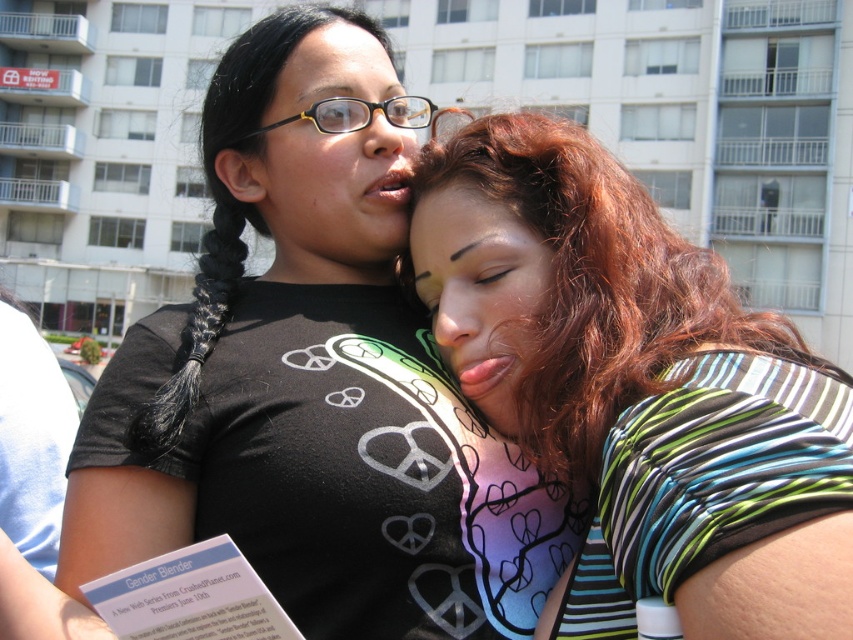
Question: Which point is farther to the camera?

Choices:
 (A) matte black hair at upper center
 (B) striped fabric shirt at center

Answer: (A)

Question: Is striped fabric shirt at center in front of matte black hair at upper center?

Choices:
 (A) yes
 (B) no

Answer: (A)

Question: Is black matte shirt at upper left above striped fabric shirt at center?

Choices:
 (A) yes
 (B) no

Answer: (B)

Question: Which point appears closest to the camera in this image?

Choices:
 (A) (252, 182)
 (B) (447, 346)

Answer: (B)

Question: Is black matte shirt at upper left wider than striped fabric shirt at center?

Choices:
 (A) no
 (B) yes

Answer: (B)

Question: Which is farther from the matte black hair at upper center?

Choices:
 (A) matte skin face at center
 (B) black matte shirt at upper left

Answer: (B)